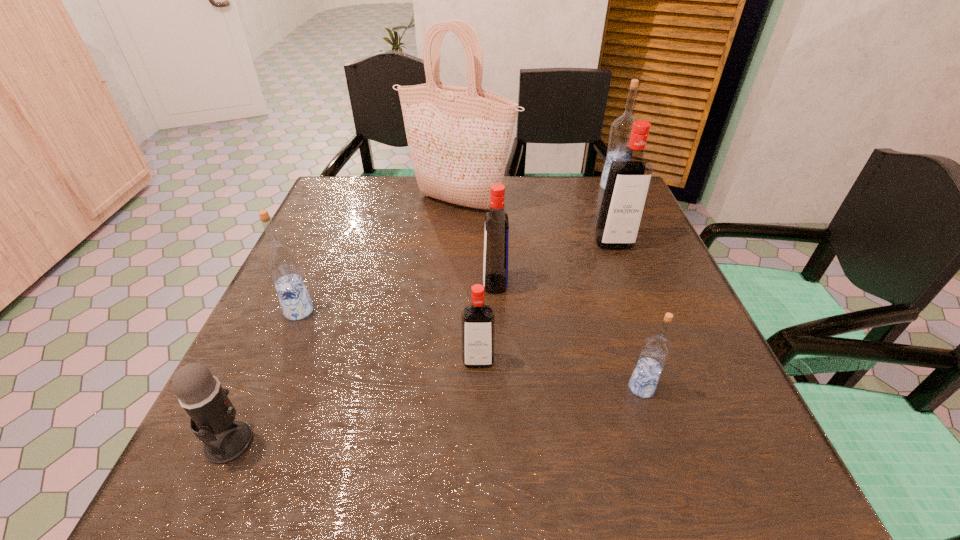
Locate an element on the screen. The image size is (960, 540). vacant space located on the front and back of the third farthest vodka is located at coordinates (456, 284).

The image size is (960, 540). In order to click on free location located 0.400m on the right of the second farthest blue vodka in this screenshot , I will do `click(509, 311)`.

Identify the location of vacant space located on the front and back of the sixth farthest object. (478, 393).

Locate an element on the screen. Image resolution: width=960 pixels, height=540 pixels. free spot located 0.380m on the left of the second blue vodka from left to right is located at coordinates (409, 388).

Find the location of `blank space located on the back of the microphone`. blank space located on the back of the microphone is located at coordinates (300, 287).

Where is `shopping bag that is at the far edge`? Image resolution: width=960 pixels, height=540 pixels. shopping bag that is at the far edge is located at coordinates (459, 137).

Where is `vodka at the far edge`? The image size is (960, 540). vodka at the far edge is located at coordinates (620, 131).

The height and width of the screenshot is (540, 960). Find the location of `object that is at the near edge`. object that is at the near edge is located at coordinates (212, 414).

The width and height of the screenshot is (960, 540). In order to click on vodka at the left edge in this screenshot , I will do `click(280, 260)`.

At what (x,y) coordinates should I click in order to perform the action: click on microphone present at the left edge. Please return your answer as a coordinate pair (x, y). Image resolution: width=960 pixels, height=540 pixels. Looking at the image, I should click on (212, 414).